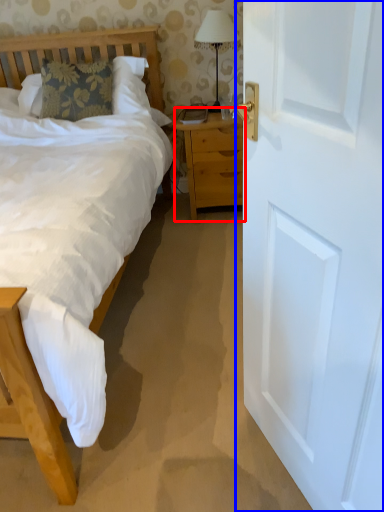
Question: Which object appears closest to the camera in this image, nightstand (highlighted by a red box) or door (highlighted by a blue box)?

Choices:
 (A) nightstand
 (B) door

Answer: (B)